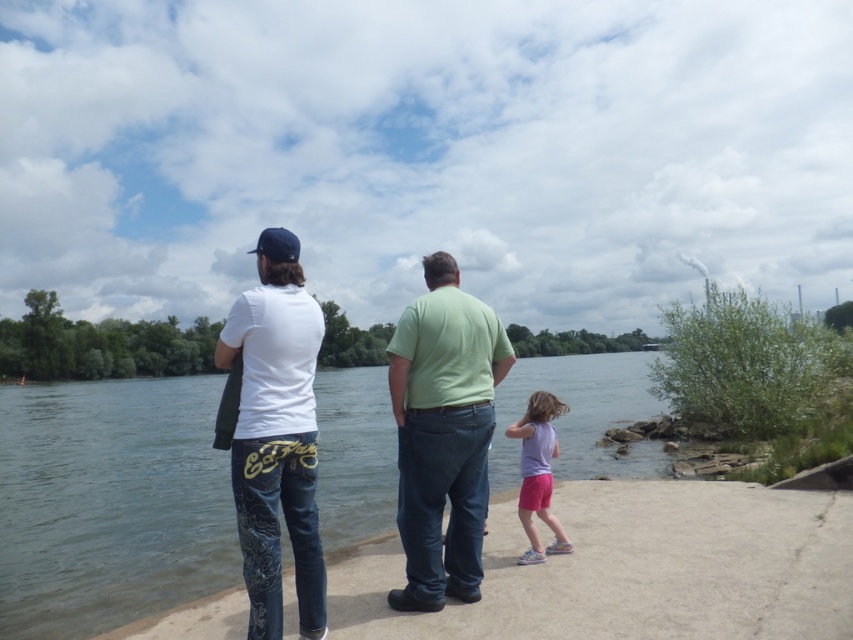
Question: Based on their relative distances, which object is nearer to the white cotton shirt at center?

Choices:
 (A) white matte t-shirt at center
 (B) smooth concrete shoreline at lower center

Answer: (A)

Question: Can you confirm if white cotton shirt at center is smaller than green matte shirt at center?

Choices:
 (A) no
 (B) yes

Answer: (A)

Question: Can you confirm if smooth concrete shoreline at lower center is positioned below white cotton shirt at center?

Choices:
 (A) yes
 (B) no

Answer: (A)

Question: Is smooth concrete shoreline at lower center wider than green matte shirt at center?

Choices:
 (A) no
 (B) yes

Answer: (B)

Question: Which of the following is the farthest from the observer?

Choices:
 (A) (822, 627)
 (B) (300, 465)
 (C) (263, 401)

Answer: (A)

Question: Among these objects, which one is nearest to the camera?

Choices:
 (A) purple cotton shirt at lower right
 (B) white cotton shirt at center
 (C) green matte shirt at center
 (D) white matte t-shirt at center

Answer: (D)